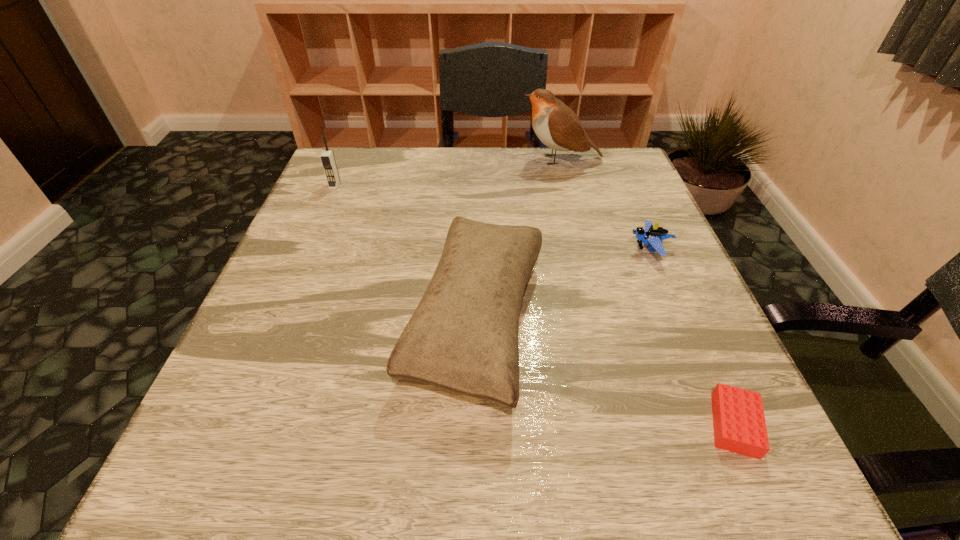
Where is `vacant space that satisfies the following two spatial constraints: 1. at the face of the nearer Lego; 2. on the right side of the tallest object`? vacant space that satisfies the following two spatial constraints: 1. at the face of the nearer Lego; 2. on the right side of the tallest object is located at coordinates (630, 425).